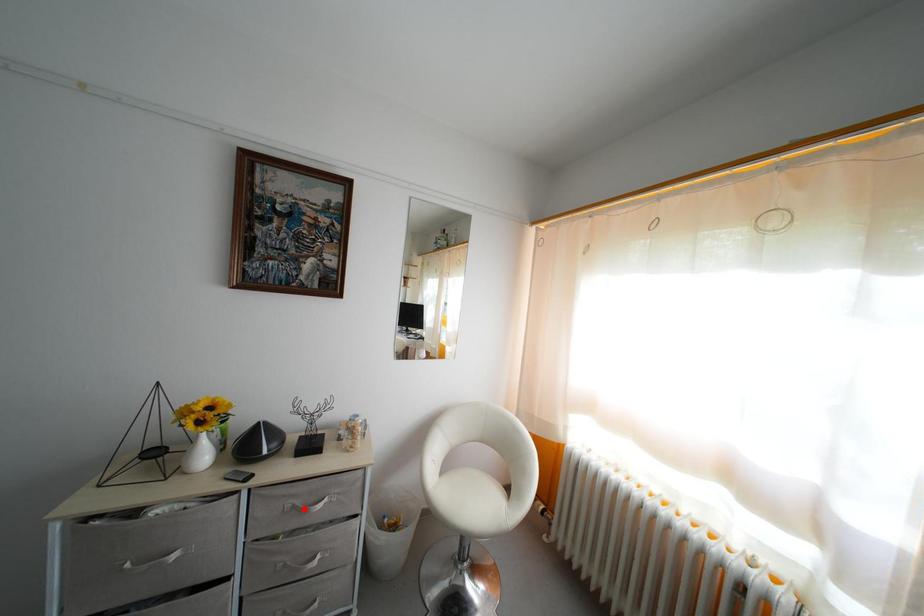
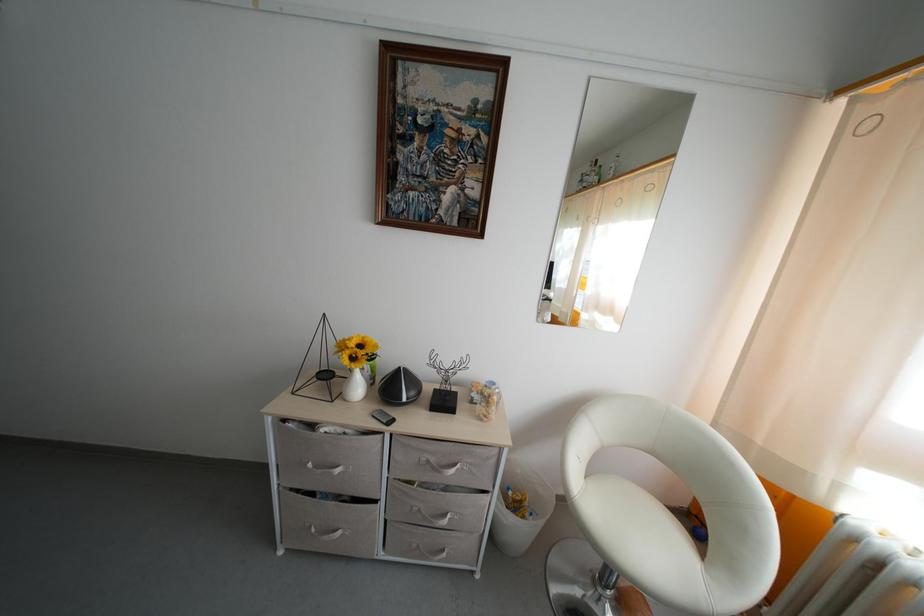
The point at the highlighted location is marked in the first image. Where is the corresponding point in the second image?

(439, 466)